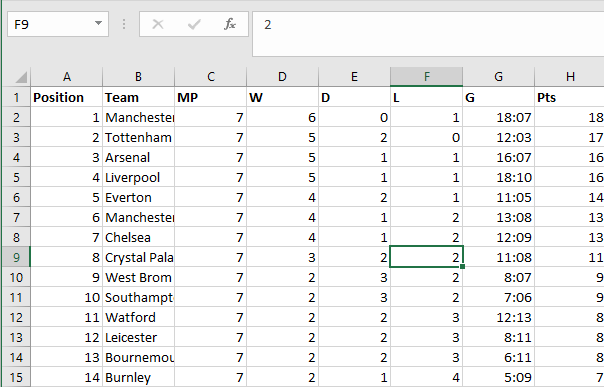
Locate an element on the screen. columns is located at coordinates (69, 74), (130, 80), (214, 72), (281, 75), (359, 76), (428, 79), (512, 72), (571, 72).